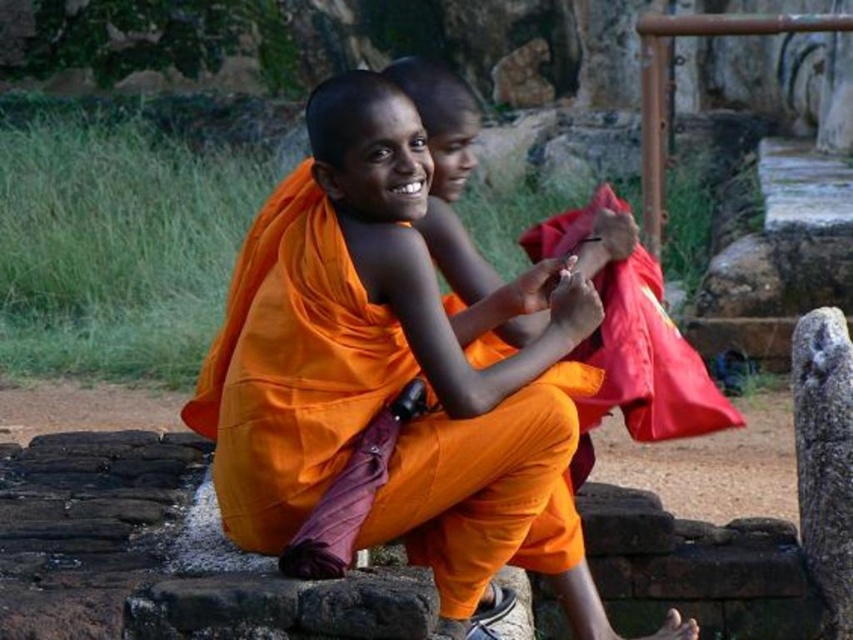
You are a photographer trying to capture a closeup of the orange cloth at center and the red cloth at center. Since you want to focus on the taller cloth, which one should you point your camera at?

The orange cloth at center is taller than the red cloth at center, so you should point your camera at the orange cloth at center to focus on the taller one.

Based on the photo, you are a photographer at this historical site and need to capture a closeup of the orange cloth at center and the red cloth at center. Which cloth should you focus on first if you want to start with the one that is more to the left?

The orange cloth at center is positioned on the left side of red cloth at center, so you should focus on the orange cloth at center first since it is more to the left.

You are a photographer trying to capture a closeup of the orange cloth at center and the red cloth at center in the image. Which cloth should you zoom in on first to ensure both are in focus, given their sizes?

The orange cloth at center is larger in size than red cloth at center, so you should zoom in on the orange cloth at center first to ensure both are in focus.